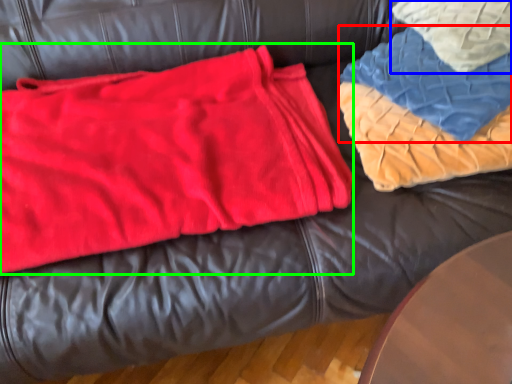
Question: Based on their relative distances, which object is nearer to blanket (highlighted by a red box)? Choose from throw pillow (highlighted by a blue box) and bean bag chair (highlighted by a green box).

Choices:
 (A) throw pillow
 (B) bean bag chair

Answer: (A)